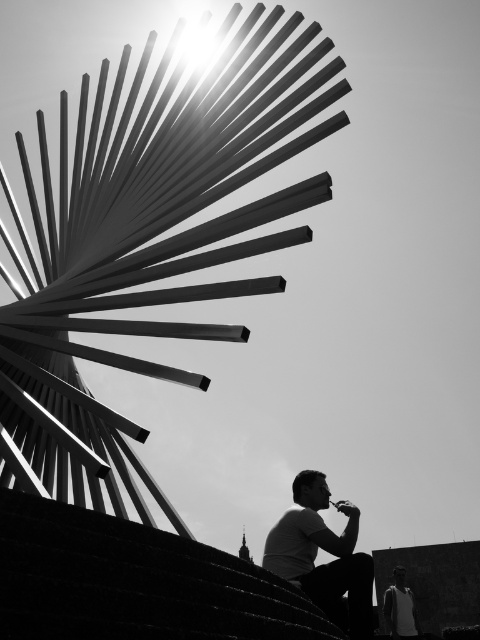
Question: Is white matte shirt at lower right positioned behind transparent plastic cup at lower right?

Choices:
 (A) no
 (B) yes

Answer: (A)

Question: Which point is farther from the camera taking this photo?

Choices:
 (A) (403, 627)
 (B) (288, 538)

Answer: (A)

Question: Which object is positioned farthest from the white matte shirt at lower right?

Choices:
 (A) transparent plastic cup at lower right
 (B) white matte tank top at lower right

Answer: (B)

Question: Can you confirm if white matte shirt at lower right is bigger than transparent plastic cup at lower right?

Choices:
 (A) yes
 (B) no

Answer: (A)

Question: Is white matte shirt at lower right above white matte tank top at lower right?

Choices:
 (A) no
 (B) yes

Answer: (B)

Question: Among these objects, which one is nearest to the camera?

Choices:
 (A) white matte tank top at lower right
 (B) white matte shirt at lower right

Answer: (B)